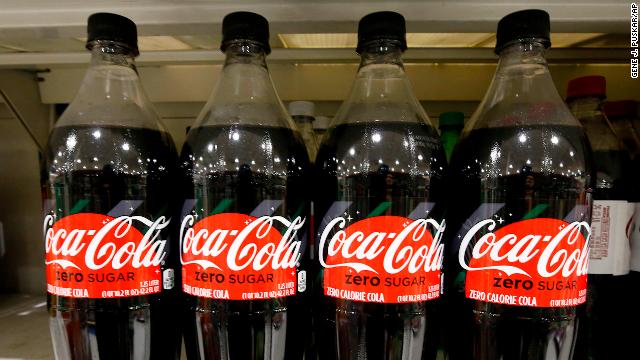
Point to visible no. of recessed lights on ceiling. in the image. Your answer should be formatted as a list of tuples, i.e. [(x1, y1), (x2, y2), ...], where each tuple contains the x and y coordinates of a point satisfying the conditions above.

[(153, 40), (20, 47), (306, 40), (561, 38)]